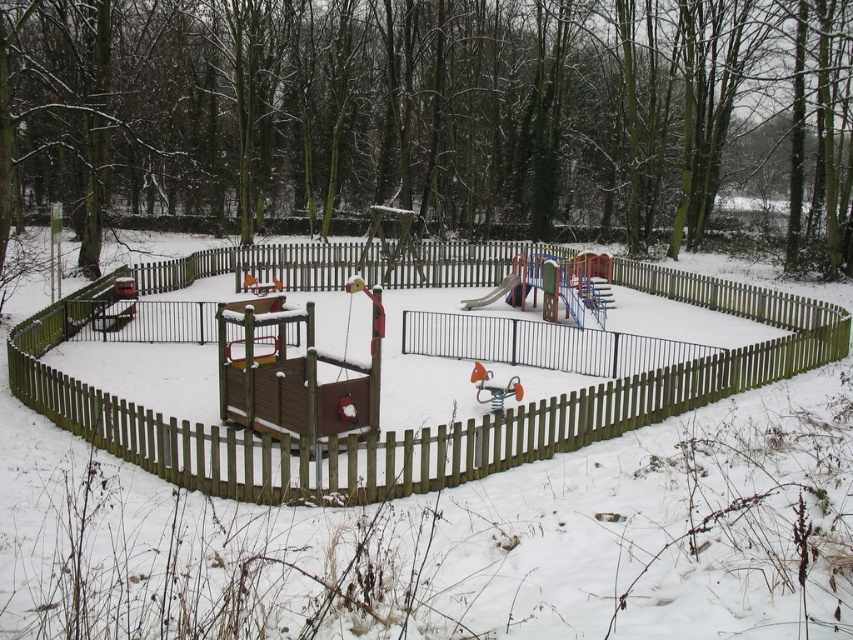
Question: From the image, what is the correct spatial relationship of brown wooden fence at center in relation to smooth plastic slide at center?

Choices:
 (A) below
 (B) above

Answer: (B)

Question: Among these objects, which one is nearest to the camera?

Choices:
 (A) brown wooden fence at center
 (B) smooth plastic slide at center

Answer: (A)

Question: Does brown wooden fence at center have a lesser width compared to smooth plastic slide at center?

Choices:
 (A) yes
 (B) no

Answer: (B)

Question: Can you confirm if brown wooden fence at center is wider than smooth plastic slide at center?

Choices:
 (A) no
 (B) yes

Answer: (B)